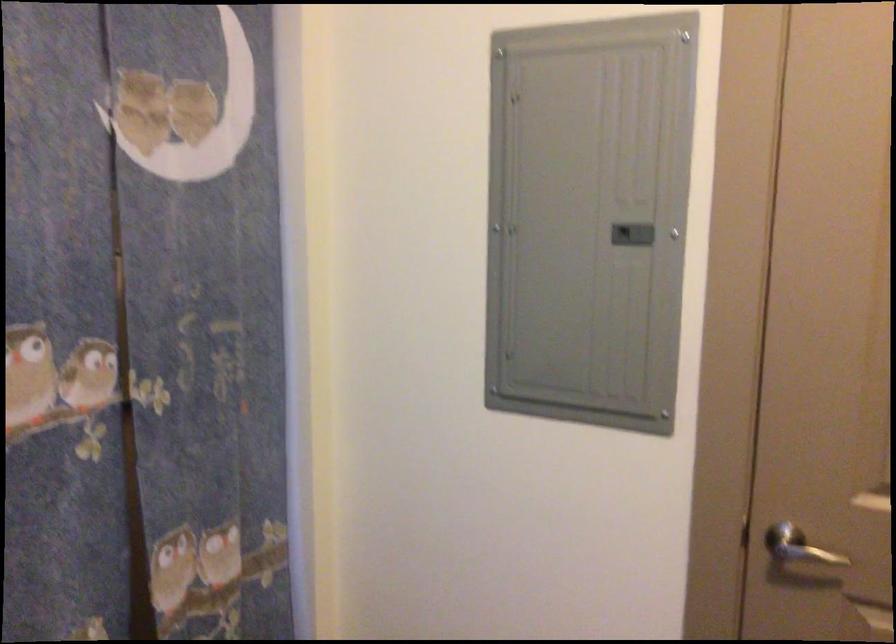
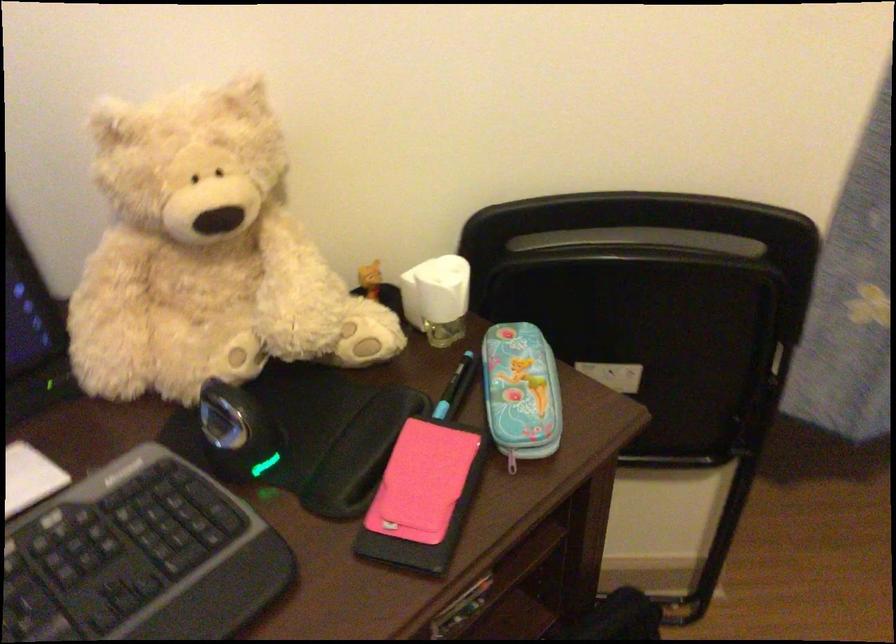
The first image is from the beginning of the video and the second image is from the end. How did the camera likely rotate when shooting the video?

The camera's rotation is toward left-down.